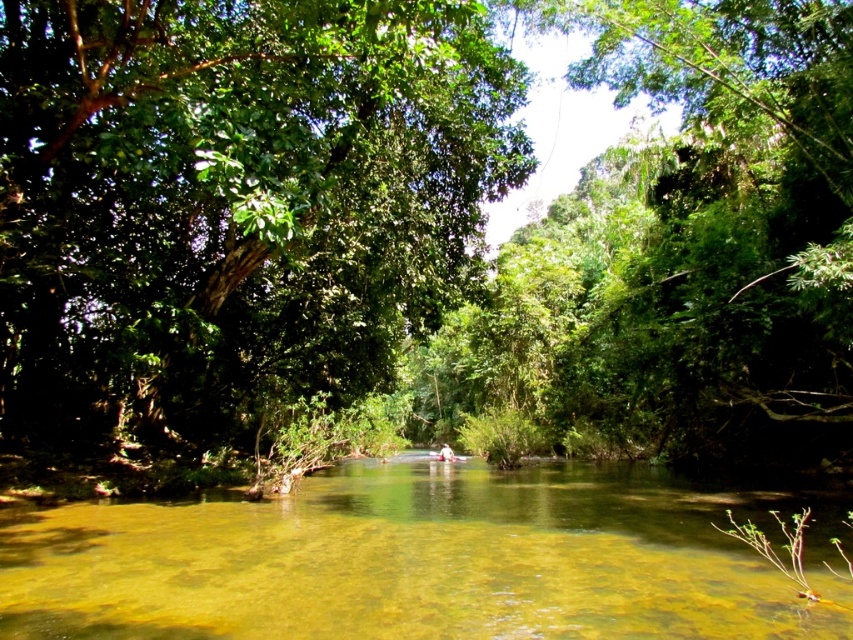
You are standing on the riverbank and see the clear water at center and the light brown wooden canoe at center. Which object is closer to you?

The clear water at center is closer to the viewer than the light brown wooden canoe at center.

You are standing on the riverbank and want to see the light brown wooden canoe at center clearly. The green leafy tree at center is blocking your view. Can you move to a position where you can see the canoe without the tree blocking it?

The green leafy tree at center is taller than the light brown wooden canoe at center. Since the tree is taller, moving to a position where the tree is not between you and the canoe should allow you to see the canoe clearly. For example, moving to the side of the tree or behind it might provide an unobstructed view.

You are a kayaker paddling down the river and want to avoid hitting the green leafy tree at center. Since you can see the clear water at center, can you tell if the tree is in the water or on the bank?

The green leafy tree at center is positioned over clear water at center, so the tree is in the water and you should avoid it.